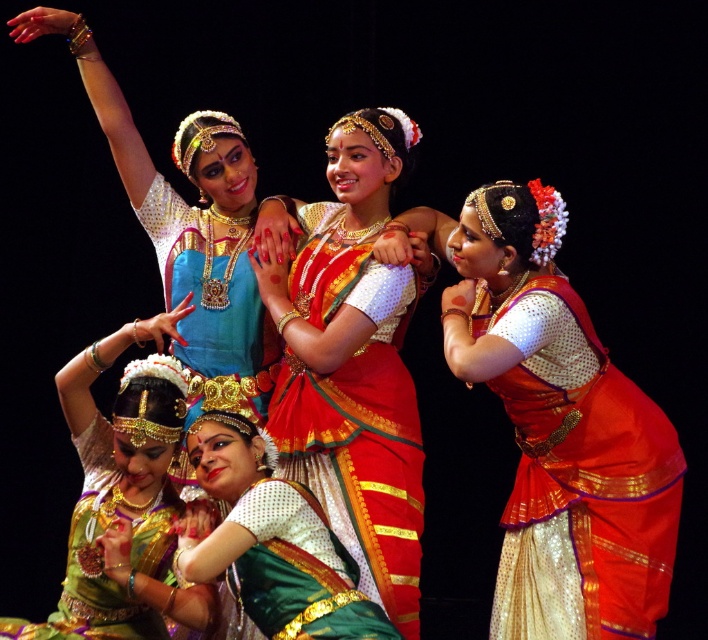
Question: Considering the real-world distances, which object is farthest from the green satin saree at lower left?

Choices:
 (A) green satin saree at center
 (B) shiny orange saree at right

Answer: (B)

Question: Estimate the real-world distances between objects in this image. Which object is closer to the green satin saree at center?

Choices:
 (A) shiny orange saree at right
 (B) green satin saree at lower left
 (C) silky green saree at center
 (D) silk saree at center

Answer: (C)

Question: Is silk saree at center wider than green satin saree at lower left?

Choices:
 (A) yes
 (B) no

Answer: (A)

Question: Which of the following is the closest to the observer?

Choices:
 (A) (382, 177)
 (B) (508, 564)
 (C) (222, 488)
 (D) (290, 502)

Answer: (D)

Question: Can you confirm if silk saree at center is positioned below green satin saree at lower left?

Choices:
 (A) no
 (B) yes

Answer: (A)

Question: Is the position of silk saree at center more distant than that of green satin saree at lower left?

Choices:
 (A) no
 (B) yes

Answer: (B)